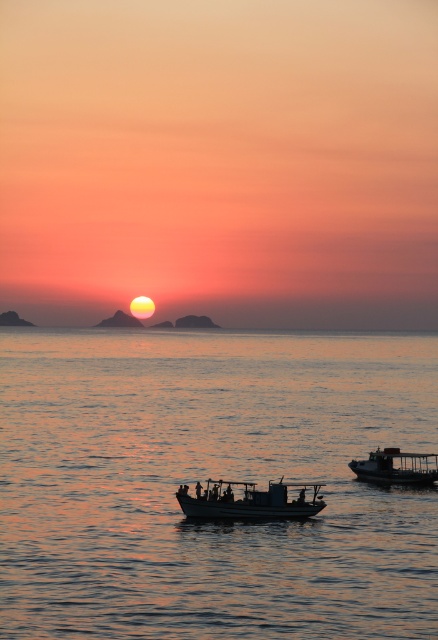
Question: Which point is closer to the camera?

Choices:
 (A) white matte boat at center
 (B) metallic gray boat at lower right
 (C) smooth water at center

Answer: (C)

Question: Among these objects, which one is farthest from the camera?

Choices:
 (A) metallic gray boat at lower right
 (B) smooth water at center
 (C) white matte boat at center

Answer: (A)

Question: Can you confirm if smooth water at center is bigger than metallic gray boat at lower right?

Choices:
 (A) no
 (B) yes

Answer: (B)

Question: Can you confirm if smooth water at center is positioned to the right of white matte boat at center?

Choices:
 (A) no
 (B) yes

Answer: (A)

Question: Is smooth water at center to the left of white matte boat at center from the viewer's perspective?

Choices:
 (A) no
 (B) yes

Answer: (B)

Question: Which point is closer to the camera?

Choices:
 (A) (240, 483)
 (B) (147, 541)

Answer: (B)